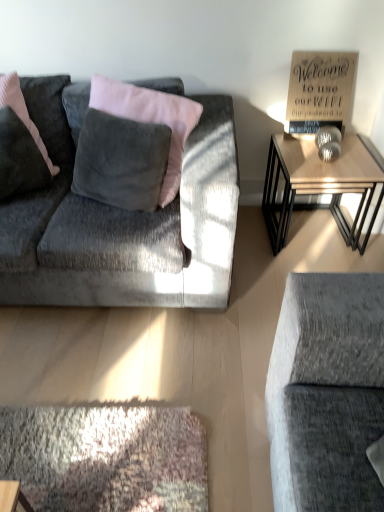
Identify the location of free space that is in between velvet gray couch at left and wooden table at right. (265, 262).